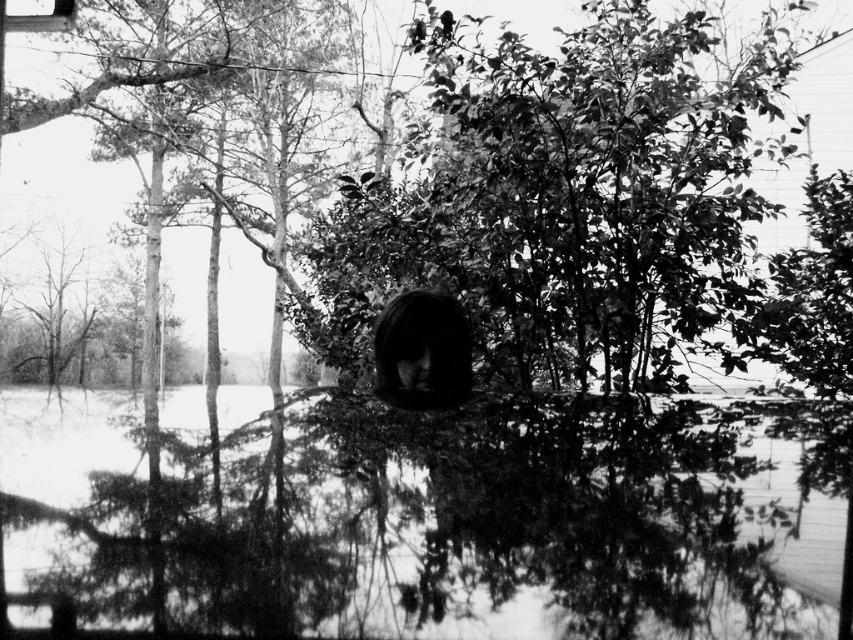
Question: Is transparent glass puddle at center wider than dark hair at center?

Choices:
 (A) no
 (B) yes

Answer: (B)

Question: Which of the following is the closest to the observer?

Choices:
 (A) dark hair at center
 (B) transparent glass puddle at center

Answer: (B)

Question: Is transparent glass puddle at center wider than dark hair at center?

Choices:
 (A) no
 (B) yes

Answer: (B)

Question: Is transparent glass puddle at center bigger than dark hair at center?

Choices:
 (A) yes
 (B) no

Answer: (A)